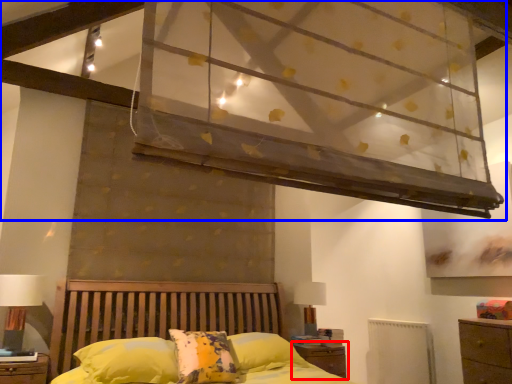
Question: Which of the following is the farthest to the observer, nightstand (highlighted by a red box) or canopy bed (highlighted by a blue box)?

Choices:
 (A) nightstand
 (B) canopy bed

Answer: (A)